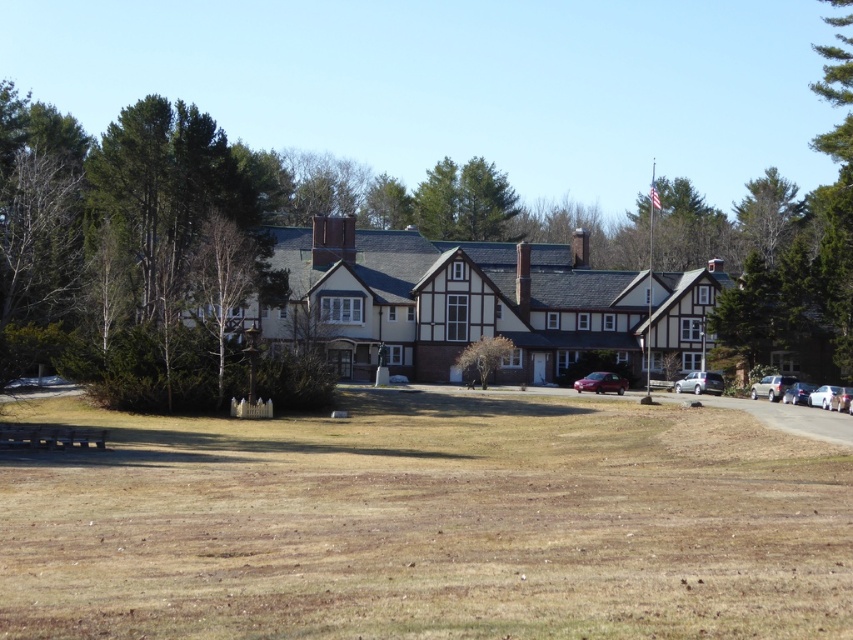
Question: Which is farther from the brown grass at lower center?

Choices:
 (A) satin silver sedan at right
 (B) satin silver suv at right

Answer: (B)

Question: Is brown grass at lower center above satin silver sedan at right?

Choices:
 (A) yes
 (B) no

Answer: (A)

Question: Which point is closer to the camera?

Choices:
 (A) (706, 380)
 (B) (476, 346)
 (C) (793, 394)

Answer: (C)

Question: Does satin silver suv at right have a larger size compared to metallic red car at center?

Choices:
 (A) no
 (B) yes

Answer: (A)

Question: Considering the relative positions of metallic red car at center and metallic silver sedan at right in the image provided, where is metallic red car at center located with respect to metallic silver sedan at right?

Choices:
 (A) below
 (B) above

Answer: (A)

Question: Which of the following is the farthest from the observer?

Choices:
 (A) satin silver sedan at right
 (B) brown textured tree at center
 (C) brown grass at lower center
 (D) metallic red car at center

Answer: (D)